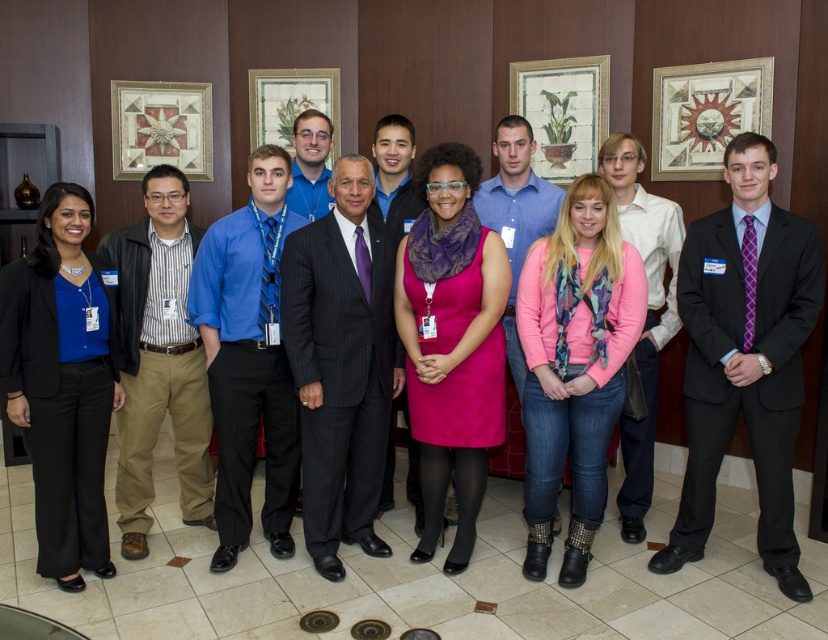
Is blue striped tie at center shorter than purple tie at center?

Correct, blue striped tie at center is not as tall as purple tie at center.

Who is shorter, blue striped tie at center or purple tie at center?

blue striped tie at center is shorter.

Is point (229, 218) positioned behind point (619, 428)?

No, it is in front of (619, 428).

Identify the location of blue striped tie at center. (249, 356).

Consider the image. Who is taller, pink soft fabric sweater at center or matte blue shirt at center?

pink soft fabric sweater at center is taller.

Is pink soft fabric sweater at center further to the viewer compared to matte blue shirt at center?

No.

Who is more distant from viewer, (621,288) or (297,161)?

The point (297,161) is more distant.

This screenshot has width=828, height=640. Identify the location of pink soft fabric sweater at center. (574, 365).

Consider the image. Is matte black blazer at left wider than wooden framed picture at center?

No, matte black blazer at left is not wider than wooden framed picture at center.

Does point (71, 259) come behind point (527, 88)?

No, (71, 259) is closer to viewer.

Identify the location of matte black blazer at left. The height and width of the screenshot is (640, 828). [x=61, y=384].